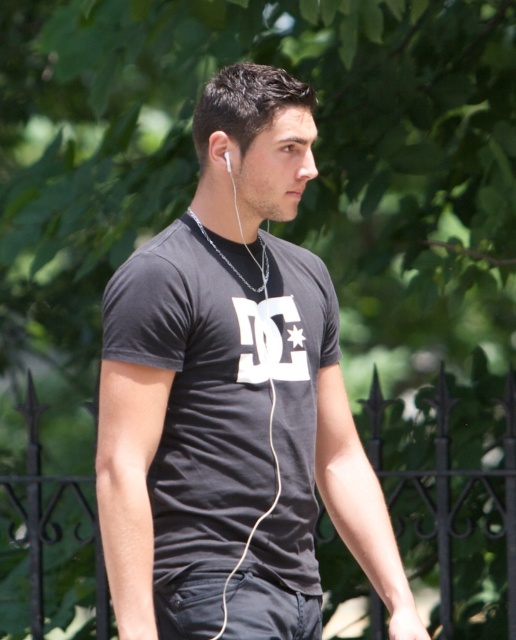
The width and height of the screenshot is (516, 640). Describe the element at coordinates (233, 397) in the screenshot. I see `matte black t-shirt at center` at that location.

Does point (107, 468) come farther from viewer compared to point (225, 164)?

No, it is not.

Where is `matte black t-shirt at center`? matte black t-shirt at center is located at coordinates (233, 397).